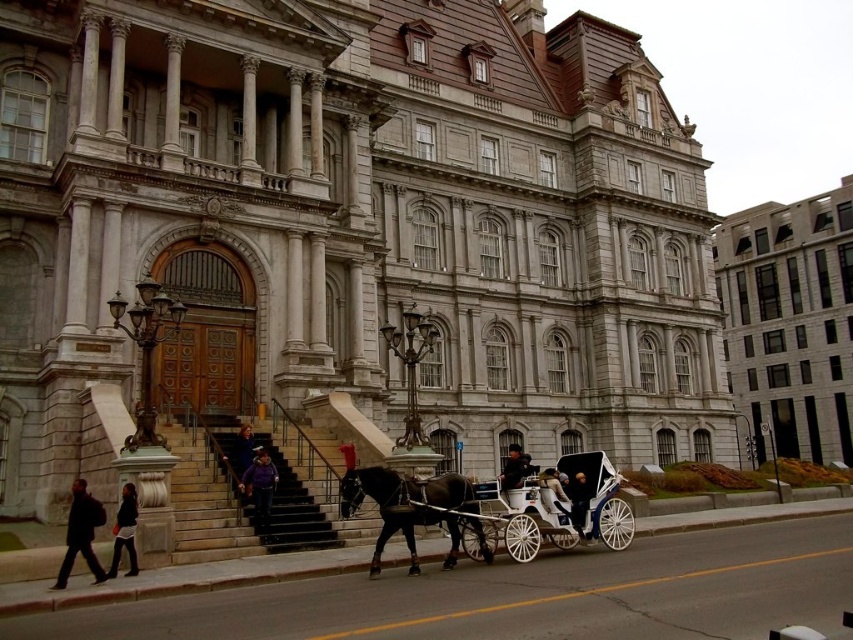
Question: Which object is positioned closest to the white polished wood horse cart at lower center?

Choices:
 (A) purple fleece jacket at lower center
 (B) dark gray jacket at lower left

Answer: (A)

Question: Among these objects, which one is nearest to the camera?

Choices:
 (A) stone staircase at center
 (B) stone building at center
 (C) light brown leather jacket at center

Answer: (A)

Question: Which point is farther to the camera?

Choices:
 (A) (567, 484)
 (B) (503, 470)
 (C) (360, 490)
 (D) (254, 481)

Answer: (B)

Question: Does white polished wood horse cart at lower center have a larger size compared to dark brown leather coat at center?

Choices:
 (A) no
 (B) yes

Answer: (A)

Question: Can you confirm if white polished wood horse cart at lower center is thinner than dark gray jacket at lower left?

Choices:
 (A) yes
 (B) no

Answer: (B)

Question: Does white stone building at right appear on the left side of dark brown leather jacket at lower left?

Choices:
 (A) yes
 (B) no

Answer: (B)